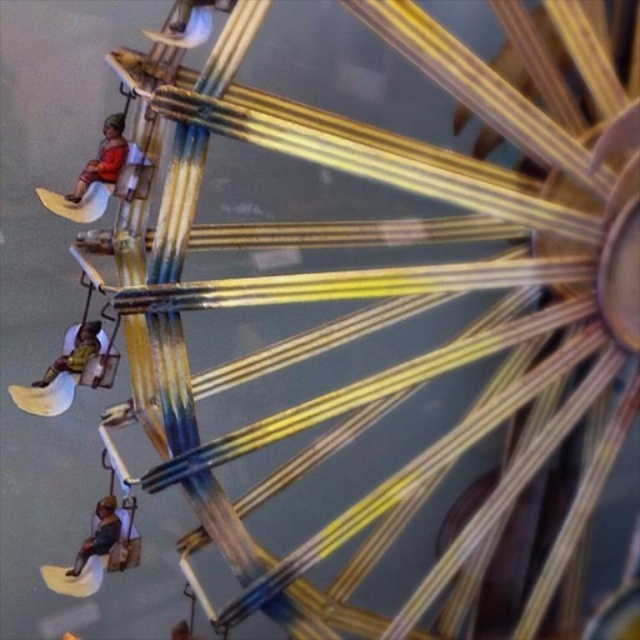
Please look at the traditional handloom with the large circular wooden frame. There are three miniature figures seated on it, and you notice a point marked at coordinates [104,157]. What color fabric is located at that specific coordinate on the handloom?

The point at coordinates [104,157] marks the location of matte orange fabric at upper left.

You are standing 3 feet away from a traditional handloom. There is a point at coordinates point (116, 138) on the loom. Can you reach that point without moving closer?

The distance of point (116, 138) from viewer is 3.39 feet, so you are currently 3 feet away. Since 3.39 feet is slightly further than 3 feet, you cannot reach the point without moving closer.